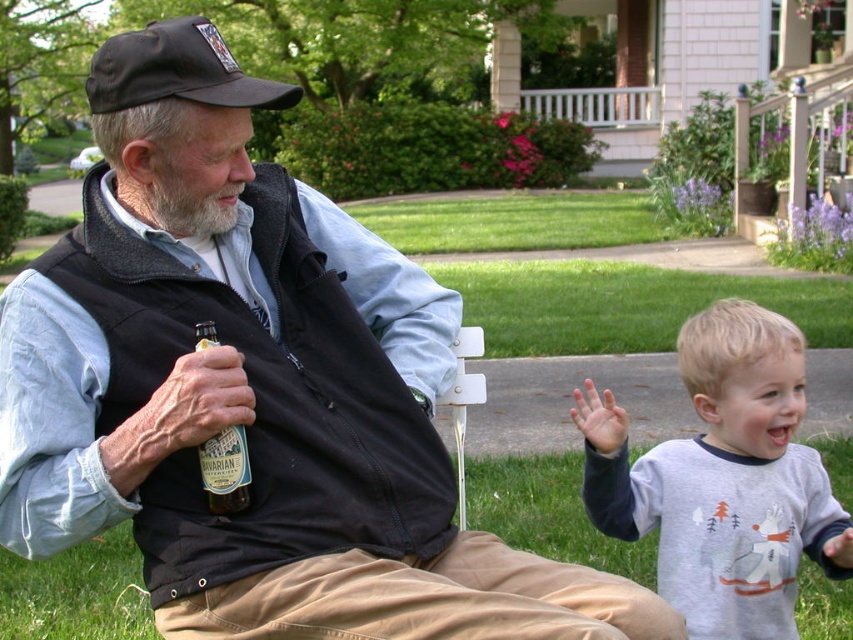
Question: Which object is closer to the camera taking this photo?

Choices:
 (A) green grass at lower center
 (B) green glass bottle at center

Answer: (B)

Question: Estimate the real-world distances between objects in this image. Which object is farther from the green glass bottle at center?

Choices:
 (A) gray cotton shirt at lower right
 (B) green grass at lower center
 (C) black fabric baseball cap at upper left

Answer: (B)

Question: Is gray cotton shirt at lower right to the right of black fabric baseball cap at upper left from the viewer's perspective?

Choices:
 (A) no
 (B) yes

Answer: (B)

Question: Is graywoollybeard at left wider than green glass bottle at center?

Choices:
 (A) no
 (B) yes

Answer: (B)

Question: Among these points, which one is nearest to the camera?

Choices:
 (A) (102, 609)
 (B) (212, 451)

Answer: (B)

Question: Considering the relative positions of green grass at lower center and black fabric baseball cap at upper left in the image provided, where is green grass at lower center located with respect to black fabric baseball cap at upper left?

Choices:
 (A) left
 (B) right

Answer: (B)